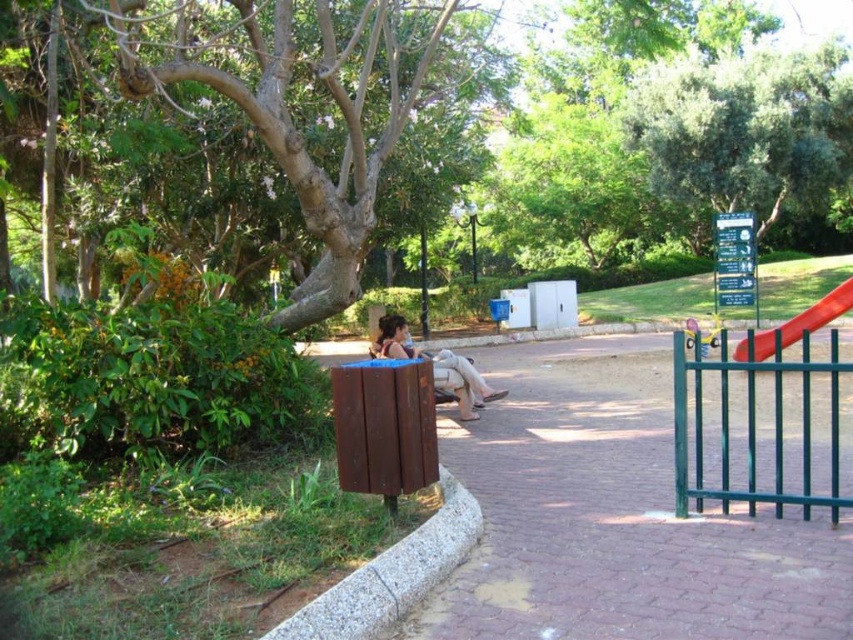
Who is higher up, brown textured tree at center or green leafy tree at upper center?

green leafy tree at upper center is higher up.

Does brown textured tree at center come behind green leafy tree at upper center?

That is False.

Does point (567, 224) come behind point (833, 76)?

Yes.

You are a GUI agent. You are given a task and a screenshot of the screen. Output one action in this format:
    pyautogui.click(x=<x>, y=<y>)
    Task: Click on the brown textured tree at center
    Image resolution: width=853 pixels, height=640 pixels.
    Given the screenshot: What is the action you would take?
    pyautogui.click(x=438, y=150)

Between green leafy tree at upper center and matte brown bench at center, which one is positioned lower?

matte brown bench at center is lower down.

Does green leafy tree at upper center appear over matte brown bench at center?

Yes, green leafy tree at upper center is above matte brown bench at center.

The height and width of the screenshot is (640, 853). Identify the location of green leafy tree at upper center. (746, 131).

The width and height of the screenshot is (853, 640). What do you see at coordinates (438, 150) in the screenshot?
I see `brown textured tree at center` at bounding box center [438, 150].

Does point (294, 120) come behind point (848, 307)?

No, (294, 120) is in front of (848, 307).

Who is more forward, (813, 81) or (811, 330)?

Positioned in front is point (811, 330).

Where is `brown textured tree at center`? brown textured tree at center is located at coordinates (438, 150).